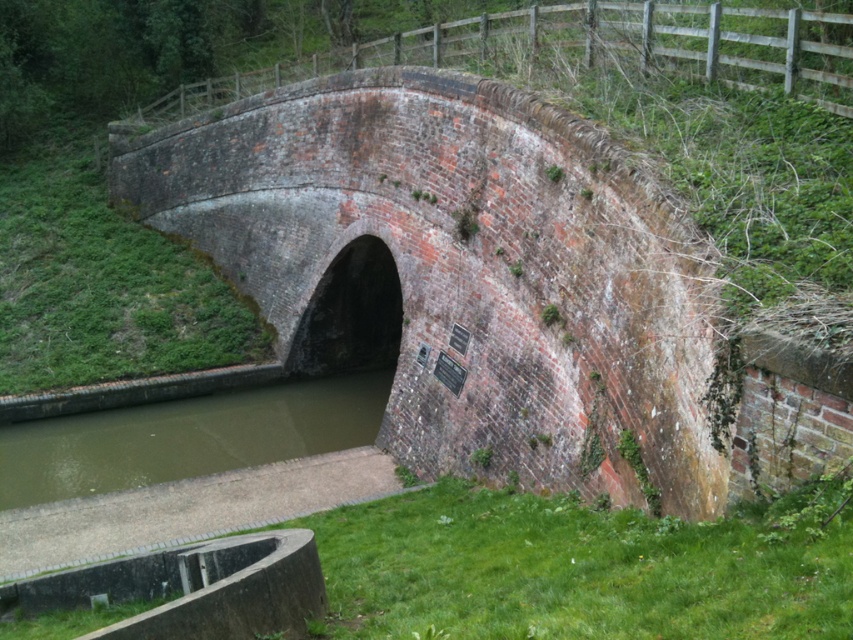
You are a delivery person carrying a package that requires a clear path under the red brick tunnel at center. The package is 2 meters tall. Can the package pass under the tunnel without hitting the green murky water at lower left?

The red brick tunnel at center is taller than the green murky water at lower left, so the package can pass under the tunnel without hitting the water.

You are standing on the historic brick bridge and want to determine the position of two points marked on the bridge. Which point is closer to you, point (x=374, y=330) or point (x=88, y=445)?

Point (x=374, y=330) is further to the viewer than point (x=88, y=445), so point (x=88, y=445) is closer to you.

You are a delivery person carrying a 7.5 meter long pipe. You need to transport it through the red brick tunnel at center. Will the pipe fit through the tunnel?

The red brick tunnel at center has a width of 7.53 meters, which is just slightly wider than the 7.5 meter pipe. The pipe should fit through the tunnel with minimal clearance.